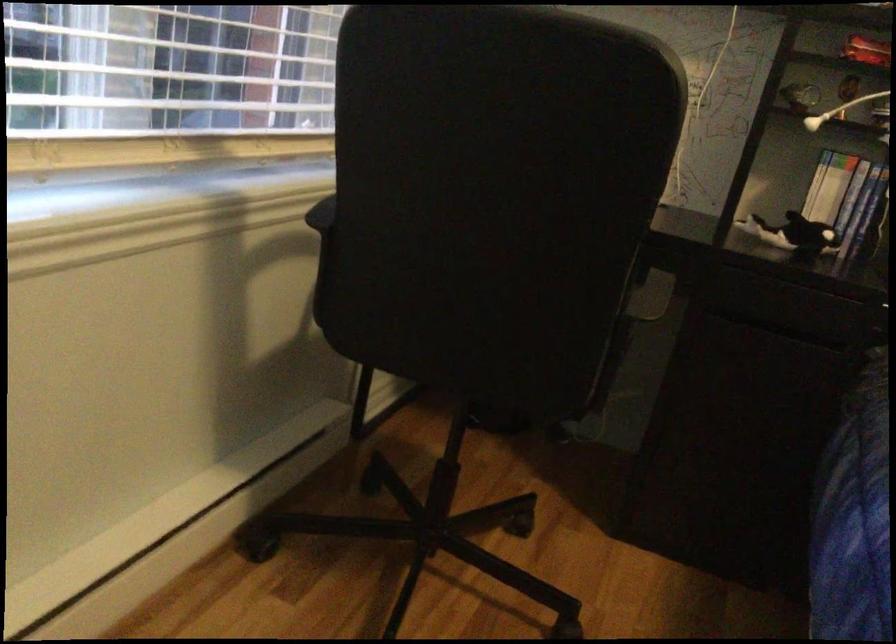
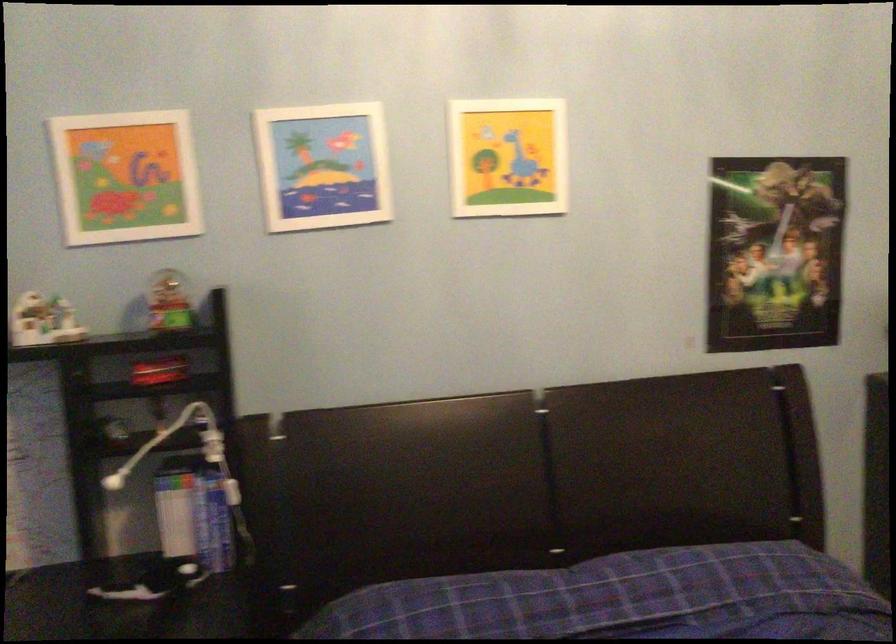
Question: The first image is from the beginning of the video and the second image is from the end. How did the camera likely rotate when shooting the video?

Choices:
 (A) Left
 (B) Right
 (C) Up
 (D) Down

Answer: (B)